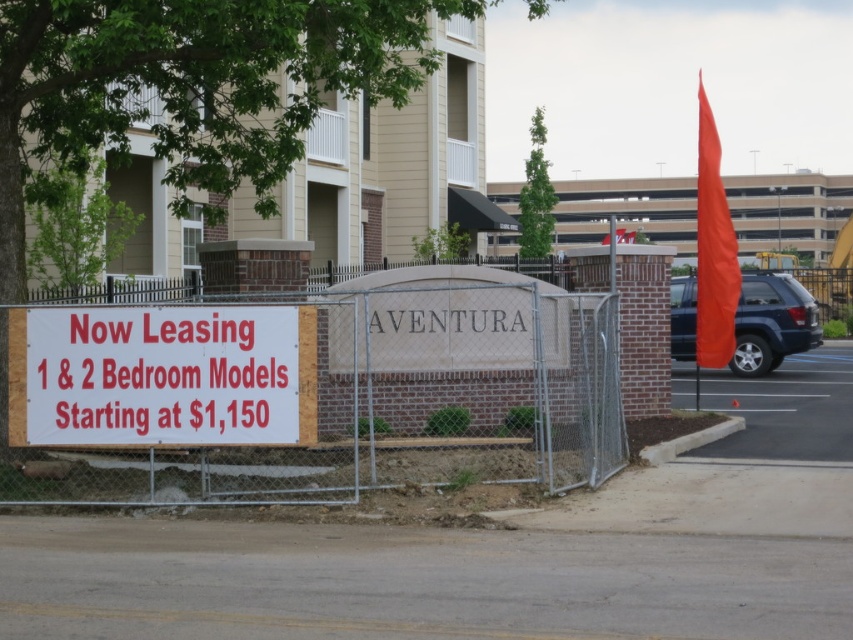
Question: Does metal chain-link fence at center appear under white paper sign at center?

Choices:
 (A) no
 (B) yes

Answer: (B)

Question: Which point is closer to the camera?

Choices:
 (A) metal chain-link fence at center
 (B) white paper sign at center

Answer: (B)

Question: Which point is closer to the camera?

Choices:
 (A) metal chain-link fence at center
 (B) white paper sign at center

Answer: (B)

Question: Does metal chain-link fence at center have a smaller size compared to white paper sign at center?

Choices:
 (A) no
 (B) yes

Answer: (B)

Question: Which point is closer to the camera?

Choices:
 (A) (595, 458)
 (B) (260, 337)

Answer: (B)

Question: Does metal chain-link fence at center lie in front of white paper sign at center?

Choices:
 (A) no
 (B) yes

Answer: (A)